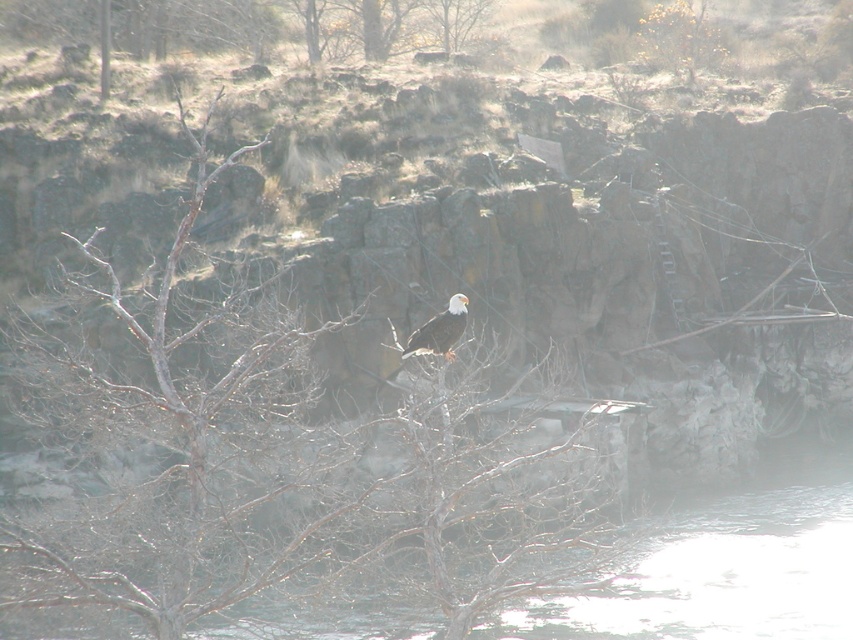
You are standing in the natural landscape scene and want to place a small flag at the closest point between the two points, point (282, 560) and point (440, 337). Which point should you choose to place the flag?

Point (282, 560) is closer to the viewer than point (440, 337), so you should place the flag at point (282, 560) to be closer.

You are a photographer trying to capture the white feathered eagle at center in the image. You notice the bare branches at center might block the view. Based on their sizes, can you determine if the eagle will be mostly visible through the branches?

The bare branches at center has a larger size compared to white feathered eagle at center, so the branches may block parts of the eagle, making it less visible.

You are standing at the origin point in the image. Which direction should you move to reach the bald eagle perched on the bare branches at center?

The bald eagle is perched on the bare branches at center located at point (279, 474), so you should move towards the upper right direction to reach it.